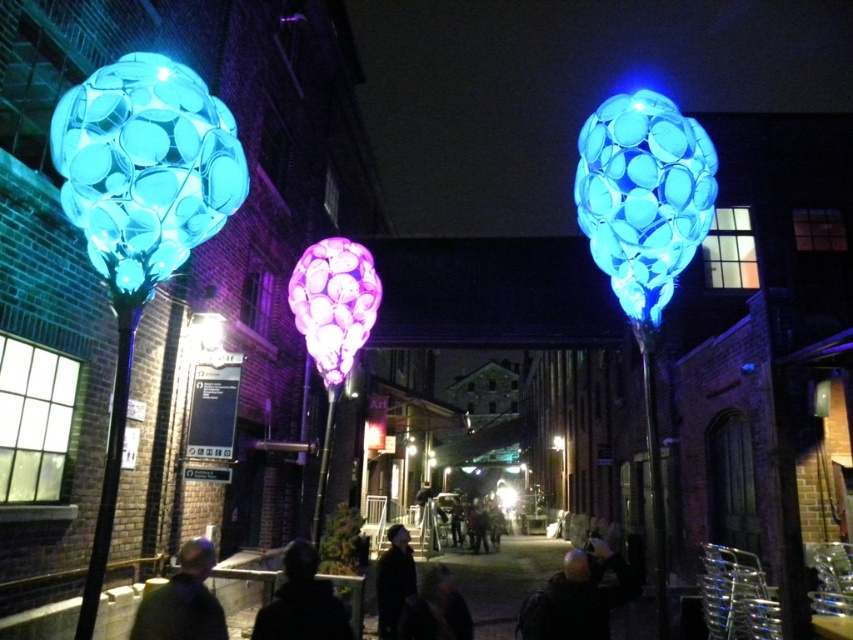
Question: Can you confirm if dark hair at lower center is thinner than dark fabric jacket at center?

Choices:
 (A) yes
 (B) no

Answer: (B)

Question: Can you confirm if black matte jacket at lower center is thinner than dark fabric jacket at center?

Choices:
 (A) yes
 (B) no

Answer: (B)

Question: Is black matte jacket at lower center thinner than dark hair at center?

Choices:
 (A) no
 (B) yes

Answer: (B)

Question: Which object is closer to the camera taking this photo?

Choices:
 (A) dark green fabric jacket at lower left
 (B) black matte jacket at lower center
 (C) dark fabric jacket at center
 (D) dark hair at center

Answer: (B)

Question: Which object appears closest to the camera in this image?

Choices:
 (A) dark hair at lower center
 (B) black matte jacket at lower center
 (C) dark fabric jacket at center

Answer: (B)

Question: Among these objects, which one is farthest from the camera?

Choices:
 (A) dark green fabric jacket at lower left
 (B) dark hair at lower center
 (C) dark fabric jacket at center
 (D) black matte jacket at lower center

Answer: (C)